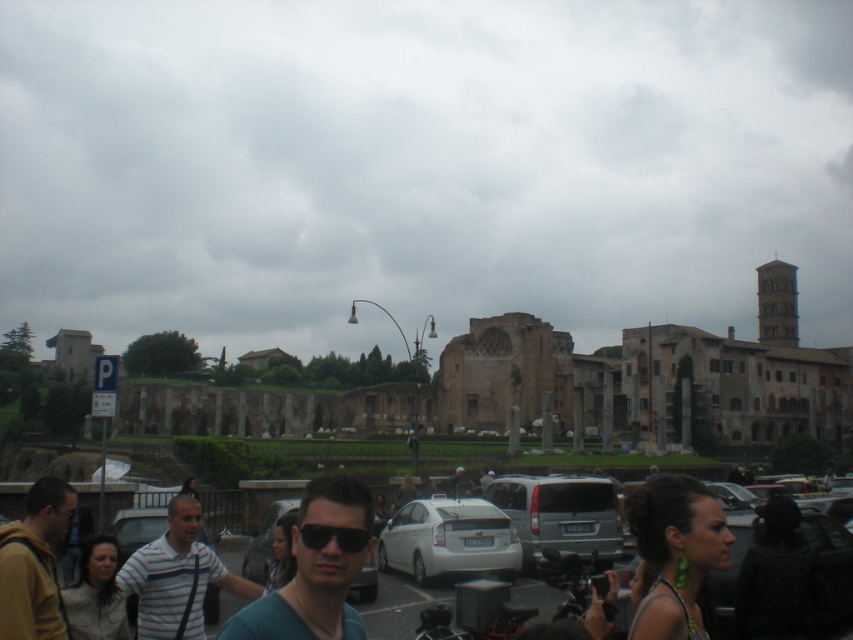
You are a photographer trying to capture a candid shot of the striped cotton shirt at center and the dark brown leather jacket at lower left. Which clothing item will appear smaller in your photo?

The striped cotton shirt at center will appear smaller in the photo because it is not as tall as the dark brown leather jacket at lower left, meaning it is closer to the camera and thus appears larger. Wait, no, the description says the striped cotton shirt is not as tall as the jacket. Hmm, maybe I need to think again. If the shirt is not as tall as the jacket, perhaps it is shorter in height, so even if it were the same distance, it would look smaller. But spatially, maybe the jacket is further away but a

You are standing at the entrance of the parking lot and see the silver metallic van at center. If you walk straight ahead, will the van come into your view? Please explain based on its position.

The silver metallic van at center is located at point [560,515], which is in the central area of the image. Since you are at the entrance of the parking lot, walking straight ahead would likely keep the van in your line of sight as it is centrally positioned.